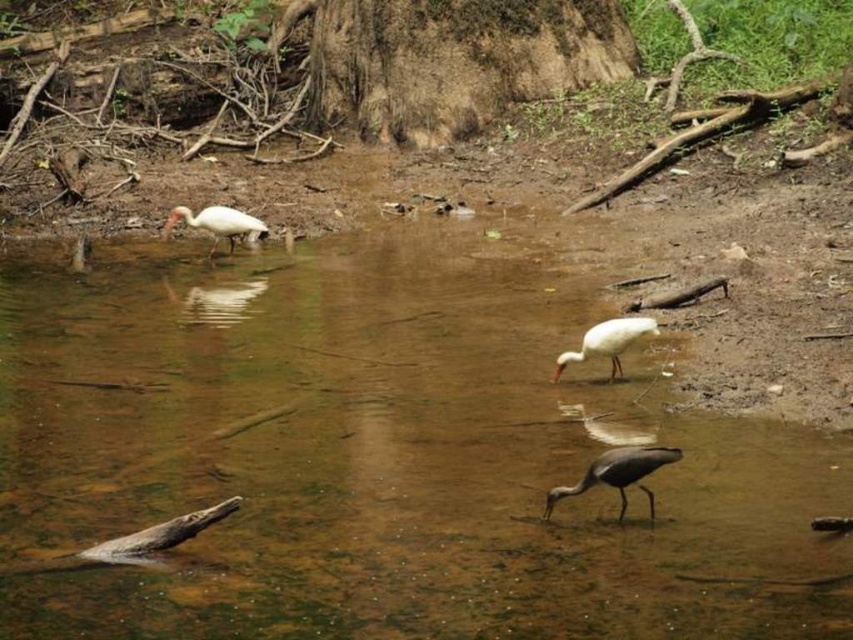
Does white matte bird at center come in front of white glossy bird at upper left?

Yes, white matte bird at center is closer to the viewer.

Does white matte bird at center appear on the right side of white glossy bird at upper left?

Correct, you'll find white matte bird at center to the right of white glossy bird at upper left.

This screenshot has height=640, width=853. I want to click on white matte bird at center, so click(x=607, y=342).

Where is `white matte bird at center`? Image resolution: width=853 pixels, height=640 pixels. white matte bird at center is located at coordinates (607, 342).

Between gray matte bird at lower center and white glossy bird at upper left, which one has less height?

With less height is gray matte bird at lower center.

Looking at this image, is gray matte bird at lower center further to the viewer compared to white glossy bird at upper left?

No, gray matte bird at lower center is in front of white glossy bird at upper left.

The height and width of the screenshot is (640, 853). What are the coordinates of `gray matte bird at lower center` in the screenshot? It's located at (614, 472).

The width and height of the screenshot is (853, 640). I want to click on gray matte bird at lower center, so click(614, 472).

Is the position of brown murky water at center less distant than that of gray matte bird at lower center?

That is False.

Describe the element at coordinates (380, 458) in the screenshot. I see `brown murky water at center` at that location.

Where is `brown murky water at center`? brown murky water at center is located at coordinates (380, 458).

Identify the location of brown murky water at center. Image resolution: width=853 pixels, height=640 pixels. (380, 458).